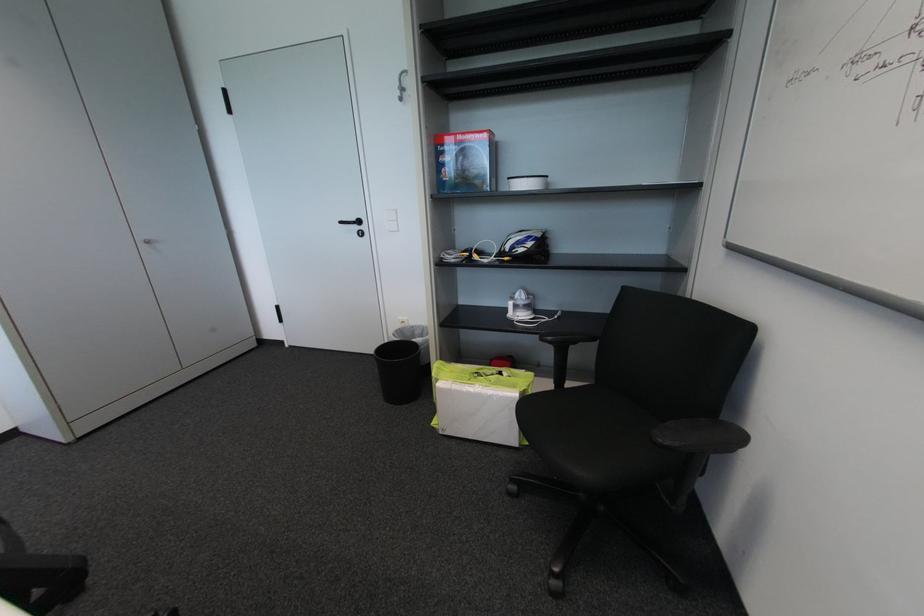
This screenshot has height=616, width=924. I want to click on black door handle, so click(x=354, y=225).